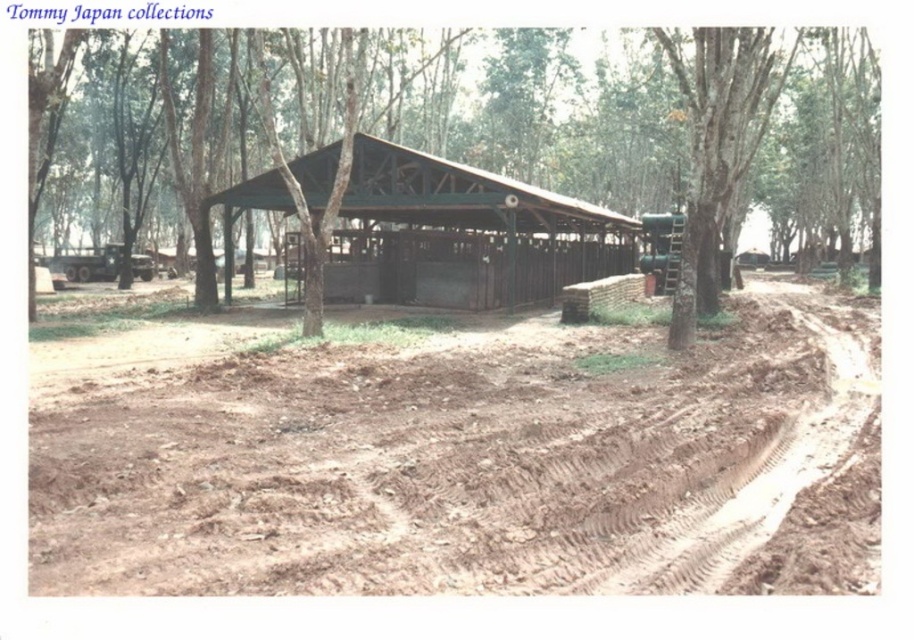
Question: Is green wood tree at center positioned in front of green rough bark tree at center?

Choices:
 (A) yes
 (B) no

Answer: (B)

Question: Which point appears closest to the camera in this image?

Choices:
 (A) (726, 92)
 (B) (553, 525)
 (C) (452, 241)

Answer: (B)

Question: Is green wood tree at center wider than green rough bark tree at center?

Choices:
 (A) no
 (B) yes

Answer: (B)

Question: Is green wood tree at center to the right of green metal hut at center from the viewer's perspective?

Choices:
 (A) no
 (B) yes

Answer: (B)

Question: Which point is farther to the camera?

Choices:
 (A) green wood tree at center
 (B) green rough bark tree at center
 (C) brown soil at center

Answer: (A)

Question: Which of these objects is positioned closest to the brown soil at center?

Choices:
 (A) green metal hut at center
 (B) green rough bark tree at center

Answer: (B)